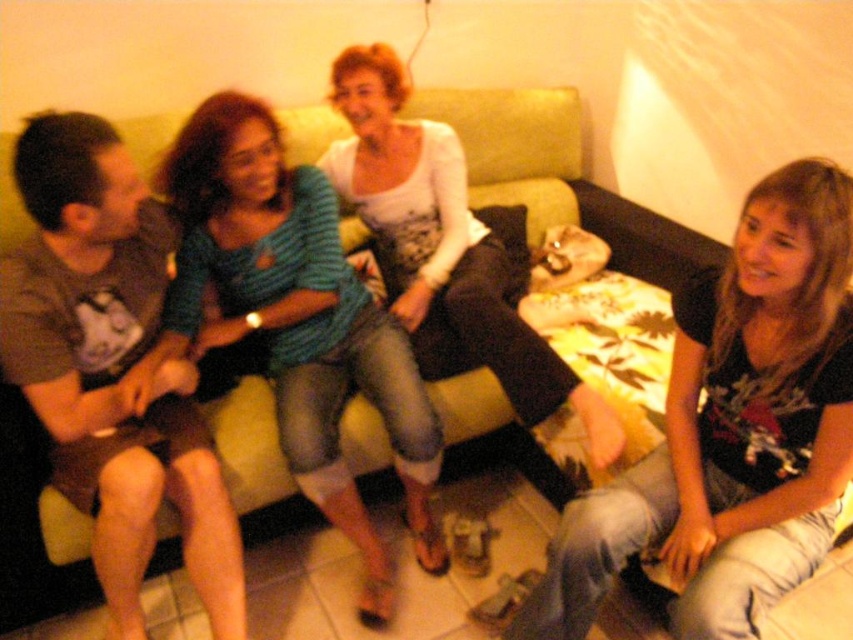
You are organizing a charity event and need to determine which of the two shirts, the black matte shirt at center or the matte brown shirt at left, would be more suitable for a large group photo where visibility is crucial. Based on their sizes, which shirt might stand out more?

The black matte shirt at center has a larger size compared to the matte brown shirt at left, so it would likely stand out more in the group photo due to its bigger size.

You are a photographer trying to capture a candid shot of the matte brown shirt at left and the blue striped shirt at center. Since you want to focus on both shirts equally, which one should you adjust your camera angle to prioritize, considering their positions?

The matte brown shirt at left is positioned under the blue striped shirt at center, so to focus on both equally, you should adjust your camera angle to look slightly upward to ensure both shirts are in clear view.